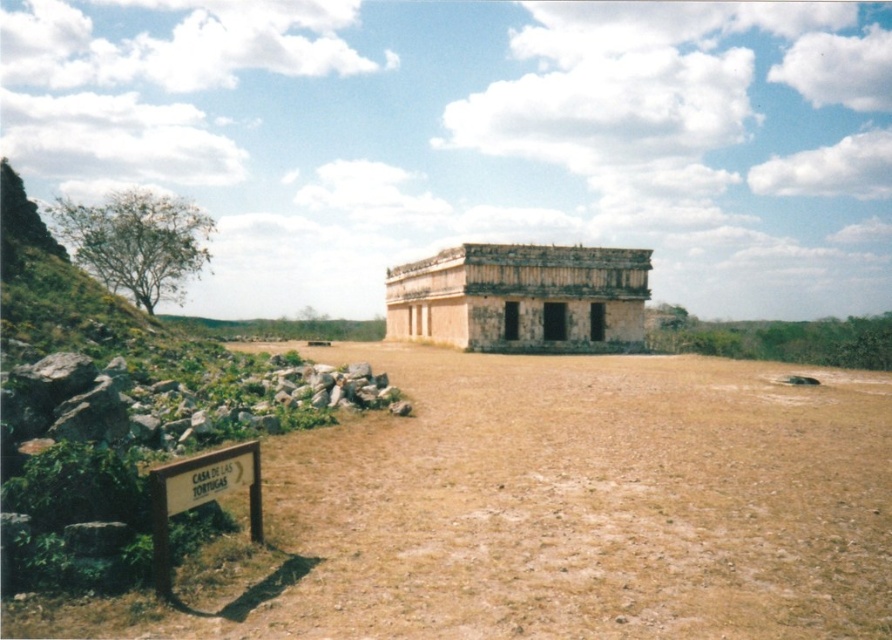
You are standing at the signpost labeled CASA DE LAS TORTUGAS and want to visit the ancient stone structure. Which point, point [320,616] or point [543,250], is closer to you as you face the structure?

Point [320,616] is closer to you than point [543,250] because it is nearer to your position at the signpost.

You are a tour guide explaining the historical site to visitors. Pointing to the brown sandy dirt field at center and the beige stone ruins at center, you want to highlight their height difference. How would you describe their relative heights?

The beige stone ruins at center are taller than the brown sandy dirt field at center.

structural integrity of the brown stone at lower left is compromised due to the height difference with the brown sandy dirt field at center. What is the reason for this?

structural integrity of the brown stone at lower left is compromised because the brown sandy dirt field at center is much taller than it.